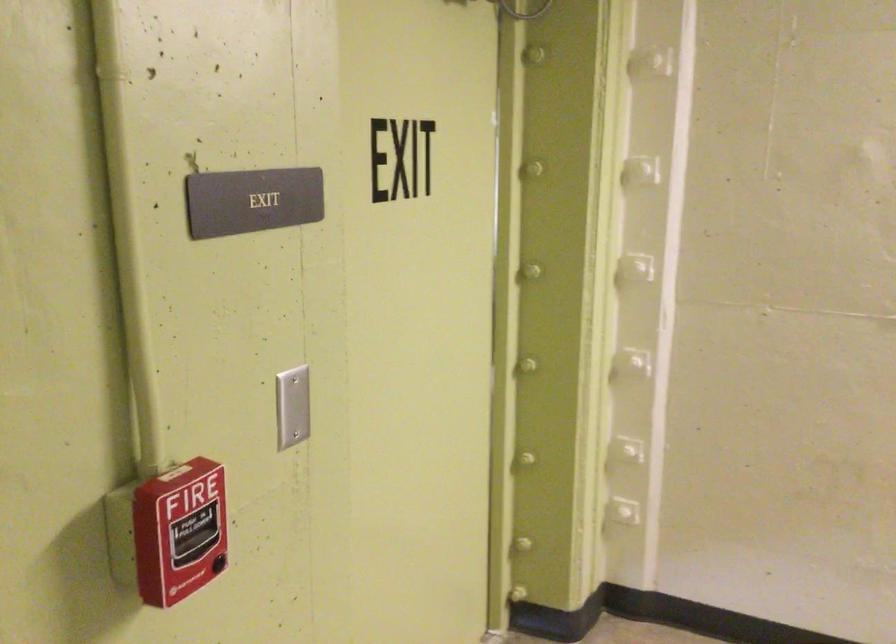
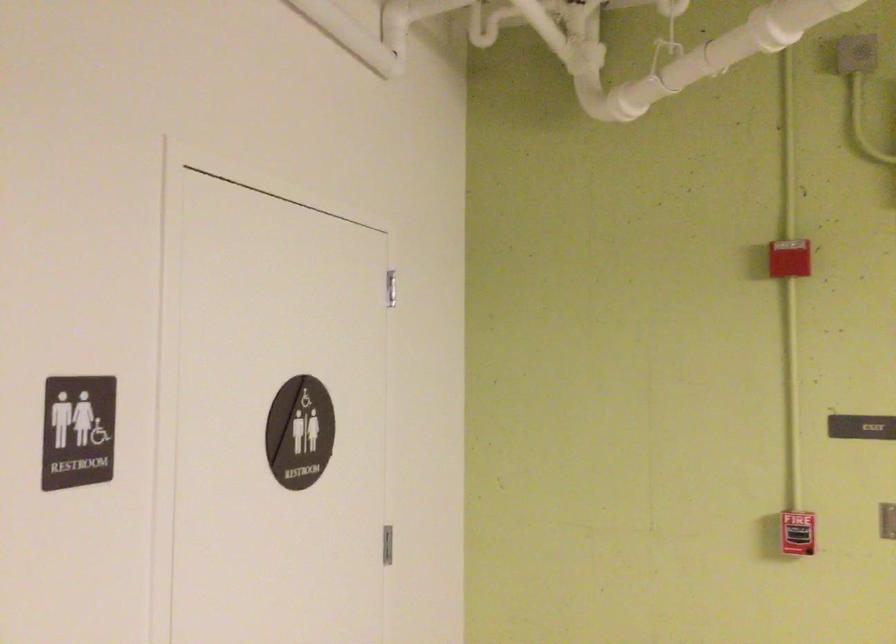
Locate, in the second image, the point that corresponds to (x=192, y=489) in the first image.

(797, 533)